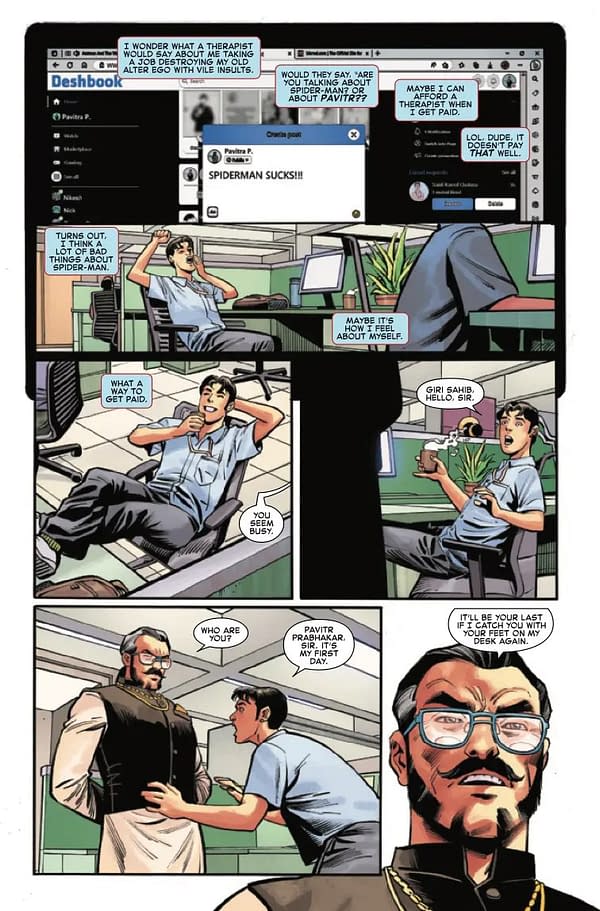
Locate an element on the screen. The image size is (600, 911). plant is located at coordinates (473, 467).